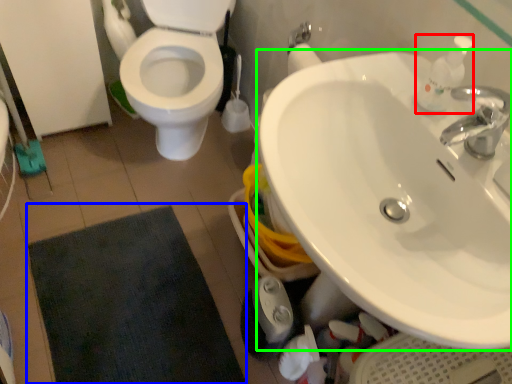
Question: Estimate the real-world distances between objects in this image. Which object is closer to soap dispenser (highlighted by a red box), bath mat (highlighted by a blue box) or sink (highlighted by a green box)?

Choices:
 (A) bath mat
 (B) sink

Answer: (B)